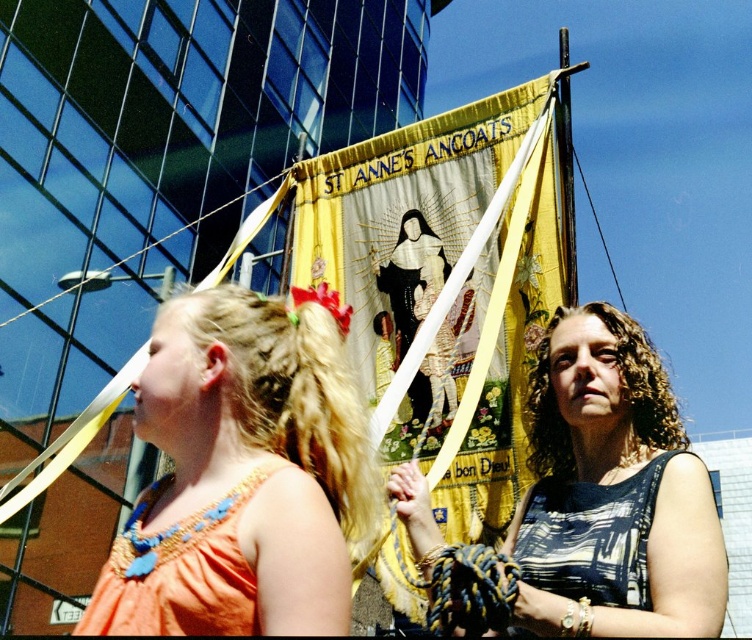
Question: Can you confirm if orange fabric dress at left is positioned below printed fabric dress at center?

Choices:
 (A) no
 (B) yes

Answer: (A)

Question: Is orange fabric dress at left to the right of printed fabric dress at center from the viewer's perspective?

Choices:
 (A) yes
 (B) no

Answer: (B)

Question: Which of these objects is positioned closest to the orange fabric dress at left?

Choices:
 (A) printed fabric dress at center
 (B) yellow fabric banner at center

Answer: (B)

Question: Among these points, which one is nearest to the camera?

Choices:
 (A) (523, 228)
 (B) (256, 465)

Answer: (B)

Question: Can you confirm if orange fabric dress at left is positioned to the right of printed fabric dress at center?

Choices:
 (A) yes
 (B) no

Answer: (B)

Question: Which object is the farthest from the printed fabric dress at center?

Choices:
 (A) orange fabric dress at left
 (B) yellow fabric banner at center

Answer: (A)